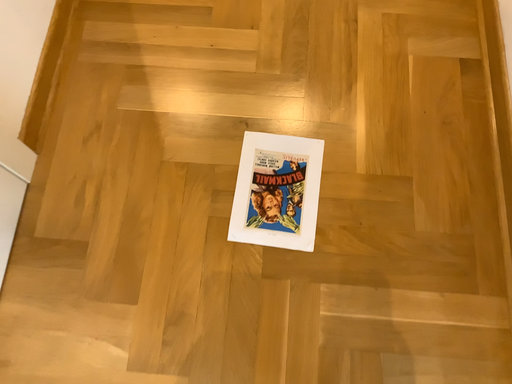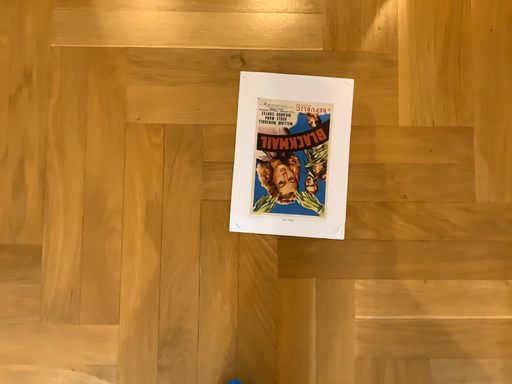
Question: Which way did the camera rotate in the video?

Choices:
 (A) rotated upward
 (B) rotated downward

Answer: (B)